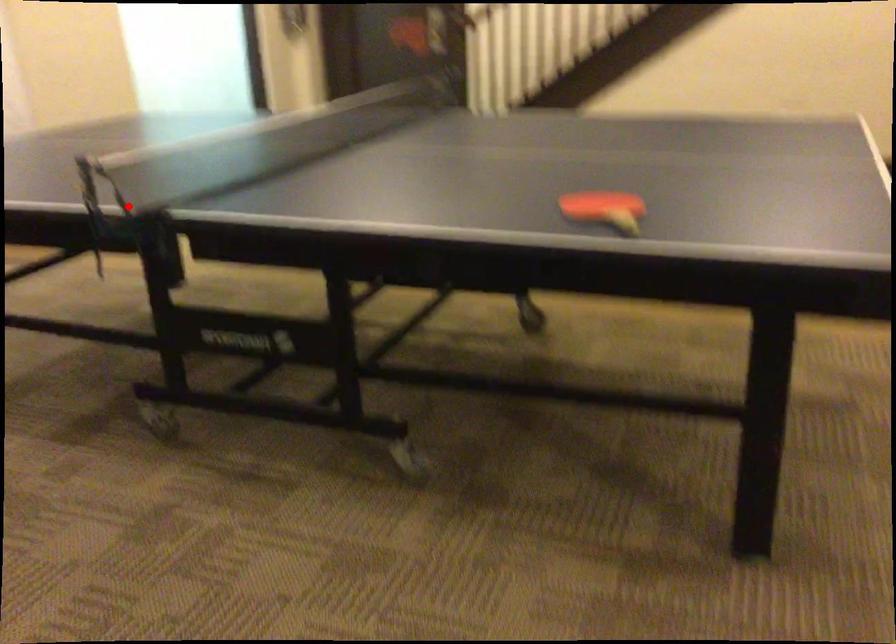
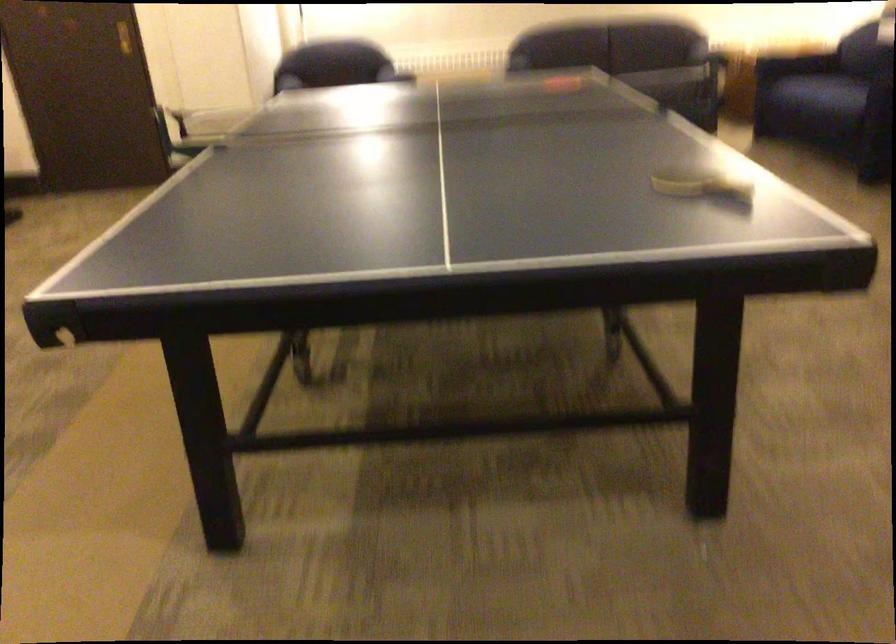
Find the pixel in the second image that matches the highlighted location in the first image.

(668, 82)